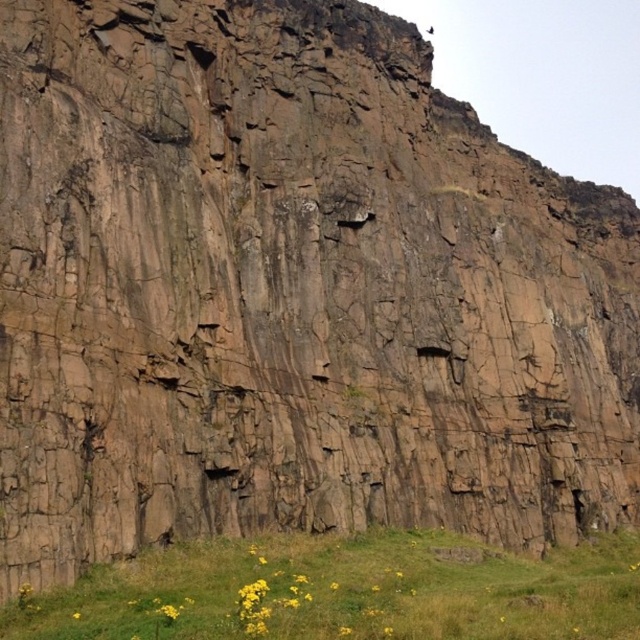
Is green grass at lower center taller than yellow matte flower at lower center?

Correct, green grass at lower center is much taller as yellow matte flower at lower center.

Is green grass at lower center closer to camera compared to yellow matte flower at lower center?

Yes, green grass at lower center is in front of yellow matte flower at lower center.

Does point (385, 534) come farther from viewer compared to point (173, 618)?

That is True.

Image resolution: width=640 pixels, height=640 pixels. What are the coordinates of `green grass at lower center` in the screenshot? It's located at (348, 589).